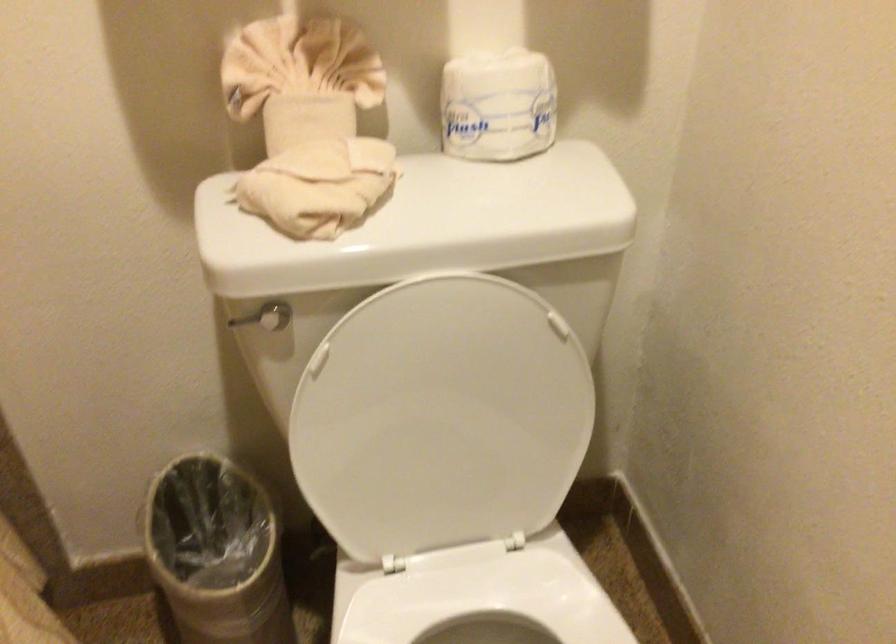
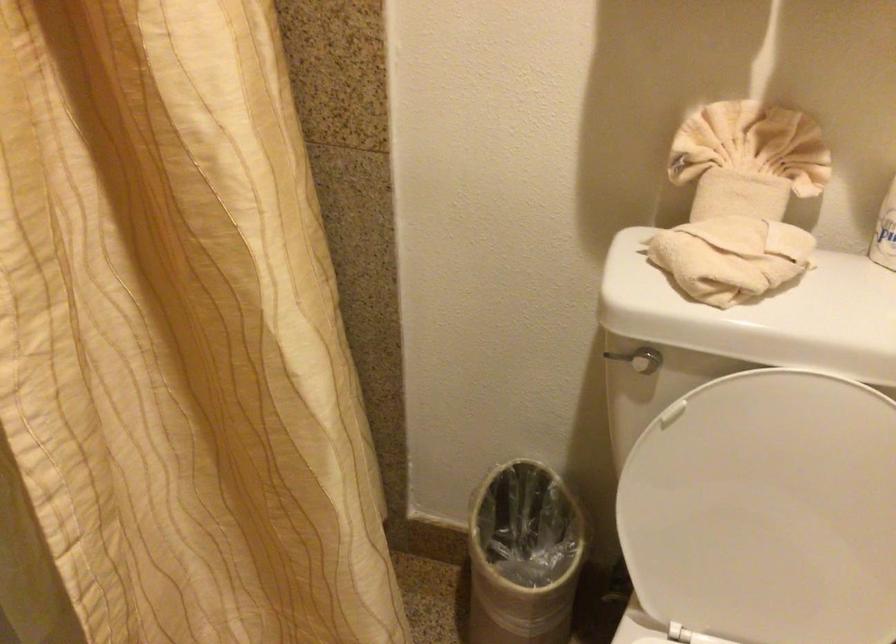
In the second image, find the point that corresponds to the point at 437,420 in the first image.

(767, 511)